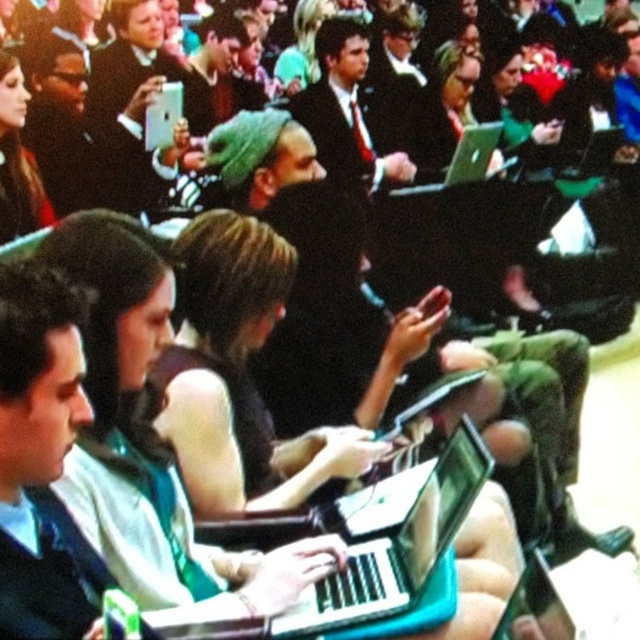
Question: Among these points, which one is farthest from the camera?

Choices:
 (A) (328, 134)
 (B) (392, 497)
 (C) (468, 170)

Answer: (C)

Question: Is dark suit at center wider than matte black laptop at upper right?

Choices:
 (A) yes
 (B) no

Answer: (A)

Question: Which of the following is the farthest from the observer?

Choices:
 (A) matte black laptop at upper right
 (B) silver metallic laptop at center
 (C) dark suit at center
 (D) matte black laptop at center

Answer: (A)

Question: From the image, what is the correct spatial relationship of dark suit at center in relation to matte black laptop at upper right?

Choices:
 (A) left
 (B) right

Answer: (A)

Question: Is silver metallic laptop at center closer to camera compared to matte black laptop at upper right?

Choices:
 (A) no
 (B) yes

Answer: (B)

Question: Which object appears farthest from the camera in this image?

Choices:
 (A) dark suit at center
 (B) matte black laptop at center
 (C) silver metallic laptop at center

Answer: (C)